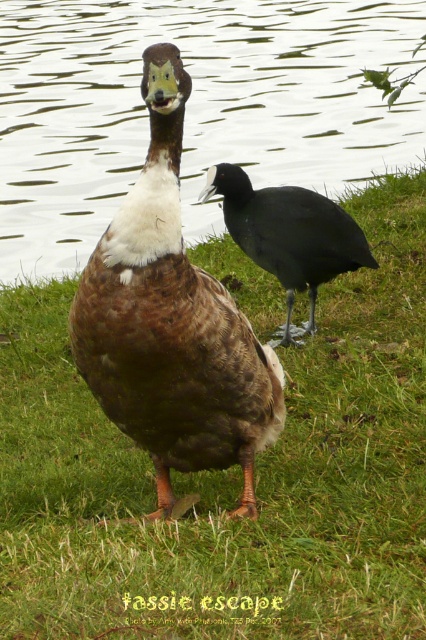
You are a birdwatcher observing the scene. You notice the brown matte duck at center and the shiny black bird at center. Which bird would cast a larger shadow if the sun is directly overhead?

The brown matte duck at center is bigger than the shiny black bird at center, so it would cast a larger shadow.